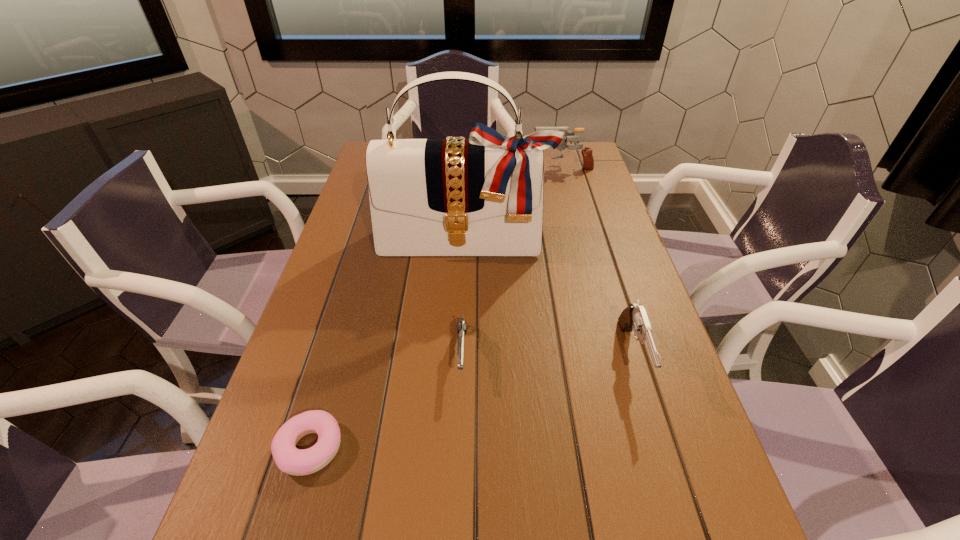
Where is `the fourth nearest object`? the fourth nearest object is located at coordinates click(483, 196).

You are a GUI agent. You are given a task and a screenshot of the screen. Output one action in this format:
    pyautogui.click(x=<x>, y=<y>)
    Task: Click on the tallest object
    
    Given the screenshot: What is the action you would take?
    pyautogui.click(x=483, y=196)

Identify the location of the second tallest object. (588, 162).

You are a GUI agent. You are given a task and a screenshot of the screen. Output one action in this format:
    pyautogui.click(x=<x>, y=<y>)
    Task: Click on the farthest gun
    This screenshot has height=540, width=960.
    Given the screenshot: What is the action you would take?
    pyautogui.click(x=588, y=162)

Find the location of a particular element. The width and height of the screenshot is (960, 540). the second tallest gun is located at coordinates (633, 318).

Where is `the shortest gun`? the shortest gun is located at coordinates (462, 325).

You are a GUI agent. You are given a task and a screenshot of the screen. Output one action in this format:
    pyautogui.click(x=<x>, y=<y>)
    Task: Click on the leftmost gun
    Image resolution: width=960 pixels, height=540 pixels.
    Given the screenshot: What is the action you would take?
    pyautogui.click(x=462, y=325)

The width and height of the screenshot is (960, 540). Identify the location of pastry. (289, 459).

Find the location of a particular element. Image resolution: width=960 pixels, height=540 pixels. the nearest object is located at coordinates (289, 459).

The image size is (960, 540). I want to click on free space located 0.320m on the front-facing side of the fourth nearest object, so click(x=460, y=361).